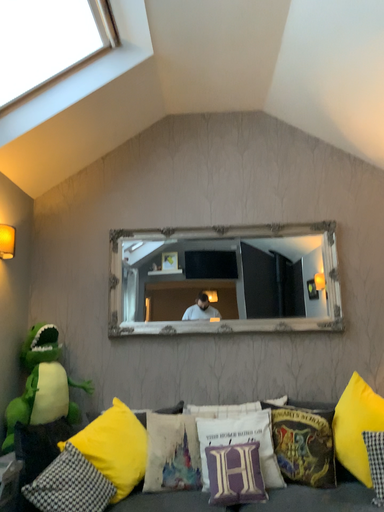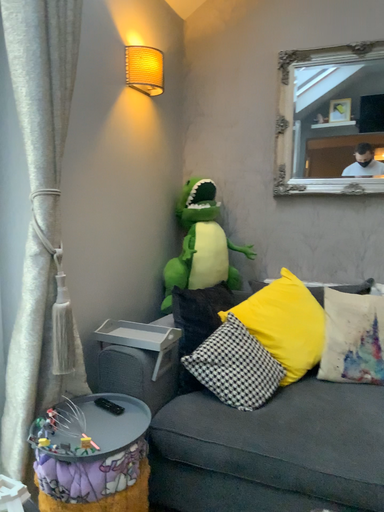
Question: How did the camera likely rotate when shooting the video?

Choices:
 (A) rotated downward
 (B) rotated upward

Answer: (A)